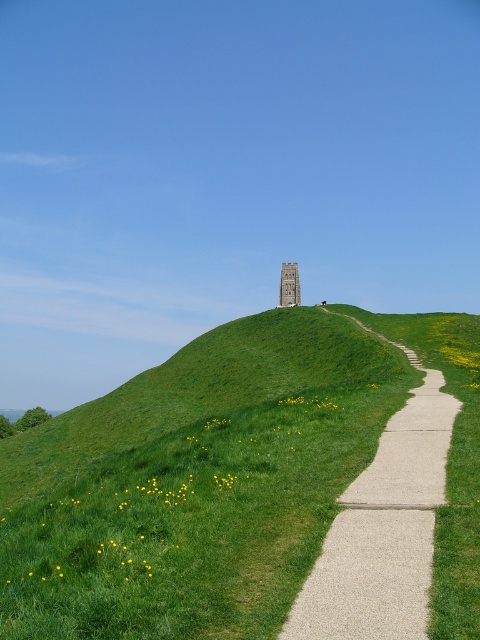
You are standing at the base of the grassy hill and want to reach the tall square stone tower at the top. There is a narrow pathway made of light gravel leading upwards from the bottom right corner. A point marked at coordinates point [245,568] is located along this path. If you start walking directly towards the tower, will you pass by this point?

The point [245,568] is located along the pathway leading up to the tower. Since the path winds upwards from the bottom right corner toward the tower, walking directly toward the tower from the base would follow the path, so yes, you would pass by the point [245,568] on your way to the tower.

You are standing at the base of the grassy hill and want to take a photo of the tower. You notice two points marked on the path leading up the hill. Which of these points, point 1 at coordinates point [360,611] or point 2 at coordinates point [279,291], is closer to you when you are positioned at the bottom right corner of the hill?

Point 1 at coordinates point [360,611] is closer to you than point 2 at coordinates point [279,291] because the description states that point [360,611] is closer to the camera than point [279,291].